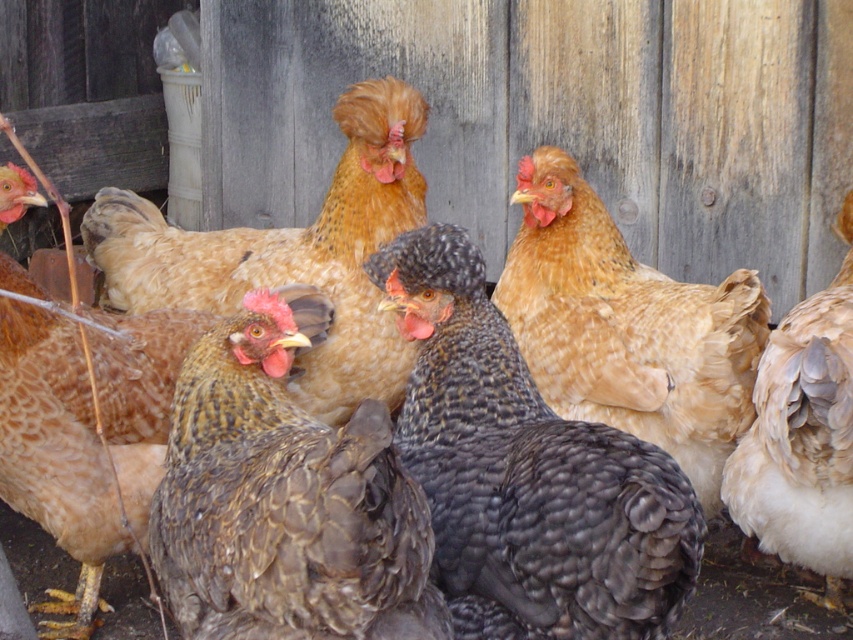
Question: Can you confirm if dark grey textured chicken at center is positioned above golden brown feathers at center?

Choices:
 (A) no
 (B) yes

Answer: (A)

Question: Which is nearer to the golden brown feathers at center?

Choices:
 (A) dark grey textured chicken at center
 (B) golden feathered chicken at center
 (C) brown speckled feathers at left
 (D) dark brown textured feathers at center

Answer: (C)

Question: Is dark grey textured chicken at center further to camera compared to golden feathered chicken at center?

Choices:
 (A) no
 (B) yes

Answer: (A)

Question: Which point is closer to the camera?

Choices:
 (A) (659, 636)
 (B) (793, 522)
 (C) (143, 198)

Answer: (A)

Question: Which point appears farthest from the camera in this image?

Choices:
 (A) (84, 625)
 (B) (784, 420)

Answer: (A)

Question: Does dark grey textured chicken at center have a lesser width compared to golden brown feathers at center?

Choices:
 (A) yes
 (B) no

Answer: (A)